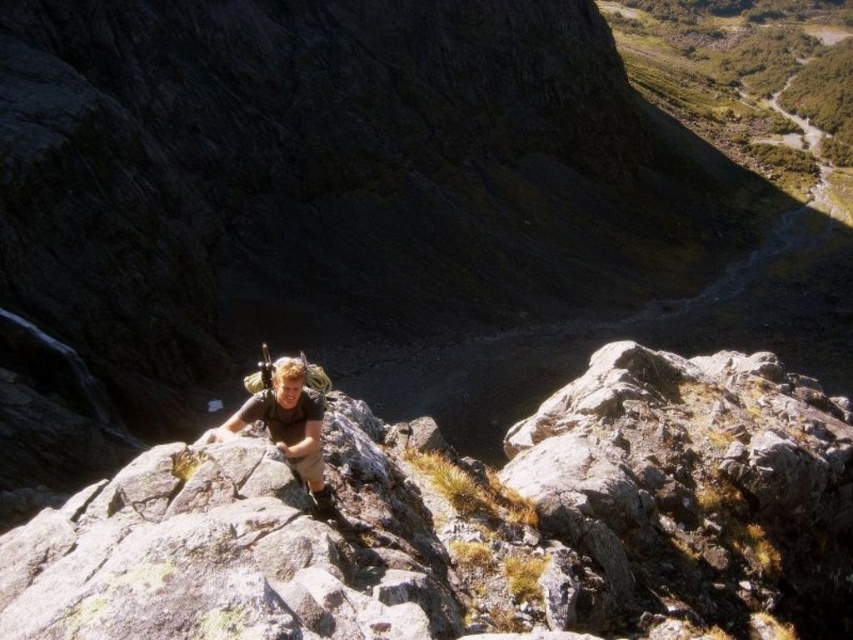
Question: Does gray rock at center appear on the left side of matte brown shirt at center?

Choices:
 (A) no
 (B) yes

Answer: (A)

Question: Is gray rock at center to the right of matte brown shirt at center from the viewer's perspective?

Choices:
 (A) yes
 (B) no

Answer: (A)

Question: Can you confirm if gray rock at center is positioned to the right of matte brown shirt at center?

Choices:
 (A) no
 (B) yes

Answer: (B)

Question: Among these points, which one is farthest from the camera?

Choices:
 (A) (306, 451)
 (B) (271, 474)

Answer: (A)

Question: Which of the following is the closest to the observer?

Choices:
 (A) gray rock at center
 (B) matte brown shirt at center

Answer: (A)

Question: Which object is farther from the camera taking this photo?

Choices:
 (A) matte brown shirt at center
 (B) gray rock at center

Answer: (A)